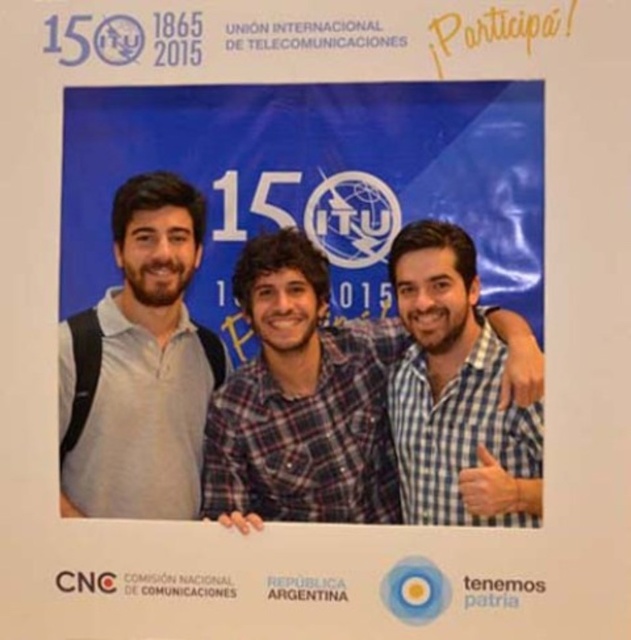
Question: Which of the following is the farthest from the observer?

Choices:
 (A) plaid shirt at center
 (B) gray matte shirt at left
 (C) checkered fabric shirt at center

Answer: (A)

Question: Which object is positioned farthest from the gray matte shirt at left?

Choices:
 (A) checkered fabric shirt at center
 (B) plaid shirt at center

Answer: (A)

Question: Does gray matte shirt at left lie behind checkered fabric shirt at center?

Choices:
 (A) no
 (B) yes

Answer: (B)

Question: Can you confirm if plaid shirt at center is wider than gray matte shirt at left?

Choices:
 (A) yes
 (B) no

Answer: (A)

Question: Where is plaid shirt at center located in relation to gray matte shirt at left in the image?

Choices:
 (A) right
 (B) left

Answer: (A)

Question: Which point appears farthest from the camera in this image?

Choices:
 (A) (498, 353)
 (B) (257, 289)

Answer: (B)